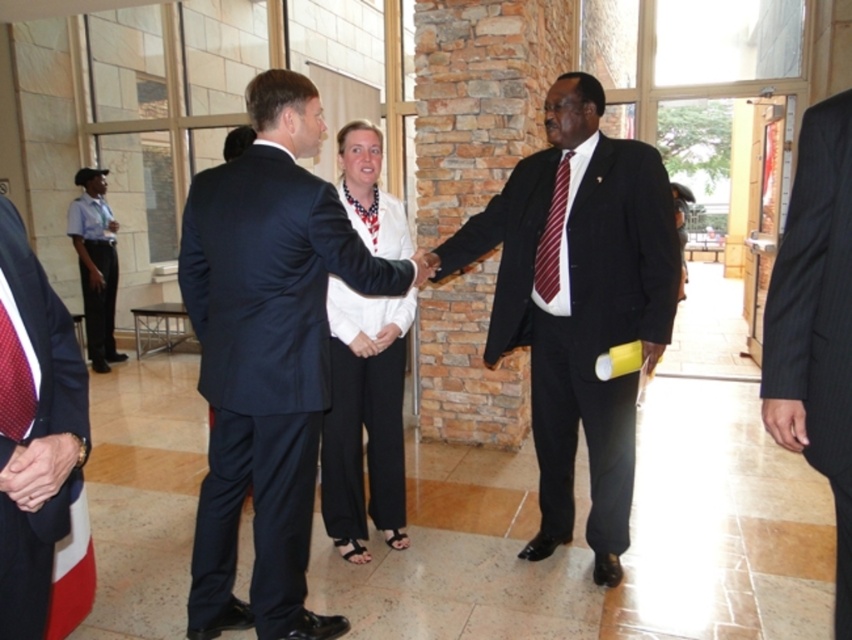
You are a photographer positioned at the back of the scene. You need to capture a clear shot of both the red dotted tie at left and the black pinstripe suit at center. Which object will appear larger in your photo?

The red dotted tie at left will appear larger in the photo because it is closer to the viewer than the black pinstripe suit at center.

You are a photographer at the event and need to capture a clear photo of both the black pinstripe suit at center and the maroon striped tie at center. Can you focus on both subjects without any obstruction?

The black pinstripe suit at center is in front of the maroon striped tie at center, so the maroon striped tie at center might be partially obscured by the black pinstripe suit at center. Adjust the angle to ensure both are visible.